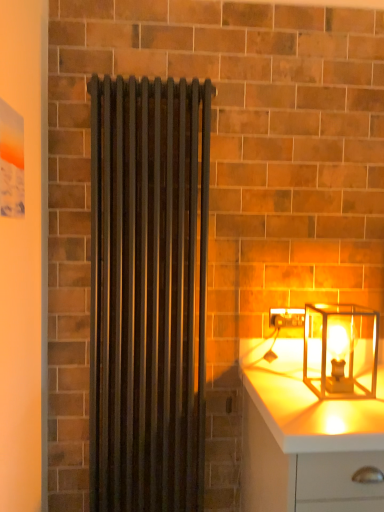
At what (x,y) coordinates should I click in order to perform the action: click on space that is in front of translucent glass lantern at right. Please return your answer as a coordinate pair (x, y). This screenshot has height=512, width=384. Looking at the image, I should click on (343, 409).